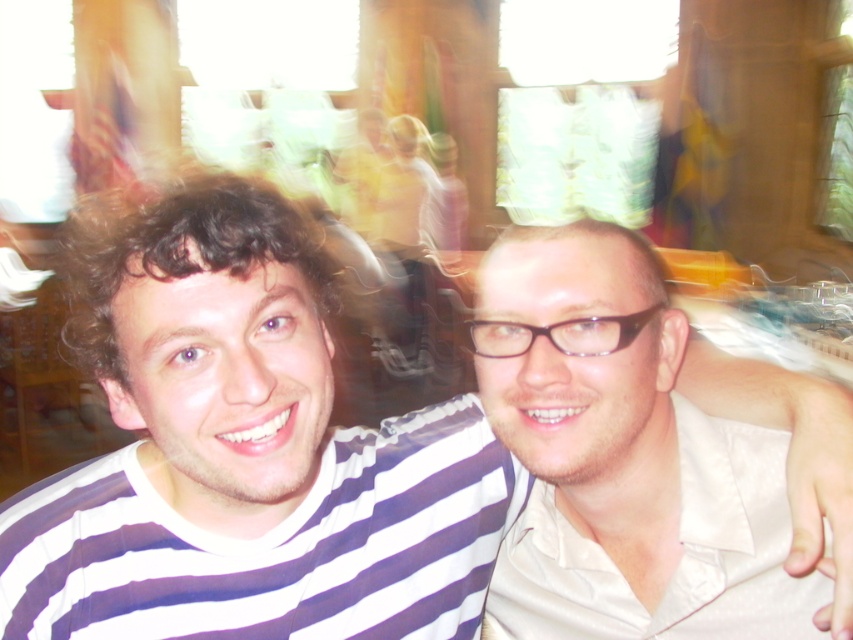
You are a photographer who wants to take a new photo of the two people in the scene. You need to ensure that the white striped shirt at center and the matte white shirt at right are both clearly visible. Given the existing motion blur, which person should you move closer to the camera to reduce blurring?

The white striped shirt at center is positioned on the left side of matte white shirt at right. To reduce blurring, move the white striped shirt at center closer to the camera since it is already on the left and adjusting their position might help in minimizing motion blur effects.

Based on the photo, you are a photographer trying to capture a clear shot of the two people in the scene. You notice that the white striped shirt at center and the matte white shirt at right are positioned close to each other. Considering their widths, which shirt should you focus on to ensure the subject fills the frame adequately without being too cramped?

The white striped shirt at center has a greater width than the matte white shirt at right. Therefore, focusing on the white striped shirt at center would allow the subject to fill the frame adequately without appearing cramped, as it occupies more space.